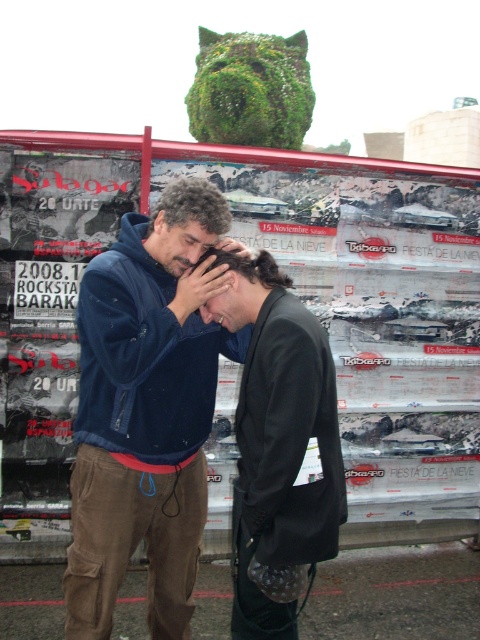
Who is more forward, (143, 353) or (245, 308)?

Point (143, 353)

Consider the image. Between dark blue fleece at center and matte black hair at center, which one appears on the left side from the viewer's perspective?

From the viewer's perspective, dark blue fleece at center appears more on the left side.

Describe the element at coordinates (144, 419) in the screenshot. I see `dark blue fleece at center` at that location.

Locate an element on the screen. This screenshot has width=480, height=640. dark blue fleece at center is located at coordinates (144, 419).

Looking at this image, does black matte jacket at center have a larger size compared to matte blue jacket at center?

Indeed, black matte jacket at center has a larger size compared to matte blue jacket at center.

Is point (218, 301) behind point (201, 253)?

No, it is in front of (201, 253).

Find the location of `black matte jacket at center`. black matte jacket at center is located at coordinates (278, 445).

Which is below, dark blue fleece at center or matte blue jacket at center?

Positioned lower is dark blue fleece at center.

Is dark blue fleece at center wider than matte blue jacket at center?

Yes.

Is point (191, 525) positioned after point (205, 236)?

Yes, point (191, 525) is behind point (205, 236).

Locate an element on the screen. Image resolution: width=480 pixels, height=640 pixels. dark blue fleece at center is located at coordinates (144, 419).